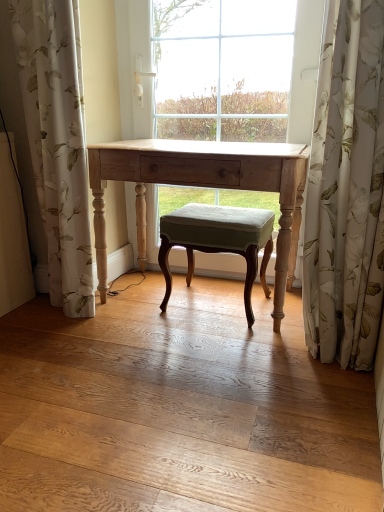
Question: Is white floral fabric at right, which is the 2th curtain from left to right, not near white floral fabric at left, positioned as the second curtain in right-to-left order?

Choices:
 (A) yes
 (B) no

Answer: (A)

Question: Is white floral fabric at right, which appears as the 1th curtain when viewed from the right, with white floral fabric at left, the 1th curtain when ordered from left to right?

Choices:
 (A) yes
 (B) no

Answer: (B)

Question: Considering the relative positions of white floral fabric at right, which is the 2th curtain from left to right, and white floral fabric at left, positioned as the second curtain in right-to-left order, in the image provided, is white floral fabric at right, which is the 2th curtain from left to right, behind white floral fabric at left, positioned as the second curtain in right-to-left order,?

Choices:
 (A) no
 (B) yes

Answer: (A)

Question: Considering the relative sizes of white floral fabric at right, which is the 2th curtain from left to right, and white floral fabric at left, positioned as the second curtain in right-to-left order, in the image provided, is white floral fabric at right, which is the 2th curtain from left to right, taller than white floral fabric at left, positioned as the second curtain in right-to-left order,?

Choices:
 (A) no
 (B) yes

Answer: (A)

Question: Can you confirm if white floral fabric at right, which is the 2th curtain from left to right, is bigger than white floral fabric at left, the 1th curtain when ordered from left to right?

Choices:
 (A) no
 (B) yes

Answer: (A)

Question: Is white floral fabric at right, which is the 2th curtain from left to right, positioned in front of white floral fabric at left, positioned as the second curtain in right-to-left order?

Choices:
 (A) no
 (B) yes

Answer: (B)

Question: Does white floral fabric at left, positioned as the second curtain in right-to-left order, have a smaller size compared to light wood table at center?

Choices:
 (A) yes
 (B) no

Answer: (A)

Question: Is white floral fabric at left, positioned as the second curtain in right-to-left order, shorter than light wood table at center?

Choices:
 (A) yes
 (B) no

Answer: (B)

Question: Is the position of white floral fabric at left, positioned as the second curtain in right-to-left order, less distant than that of light wood table at center?

Choices:
 (A) no
 (B) yes

Answer: (B)

Question: Is white floral fabric at left, the 1th curtain when ordered from left to right, positioned behind light wood table at center?

Choices:
 (A) no
 (B) yes

Answer: (A)

Question: From the image's perspective, is white floral fabric at left, positioned as the second curtain in right-to-left order, located above light wood table at center?

Choices:
 (A) yes
 (B) no

Answer: (A)

Question: Does white floral fabric at left, positioned as the second curtain in right-to-left order, have a lesser width compared to light wood table at center?

Choices:
 (A) yes
 (B) no

Answer: (A)

Question: Considering the relative positions of velvet green stool at center and white floral fabric at left, positioned as the second curtain in right-to-left order, in the image provided, is velvet green stool at center in front of white floral fabric at left, positioned as the second curtain in right-to-left order,?

Choices:
 (A) yes
 (B) no

Answer: (B)